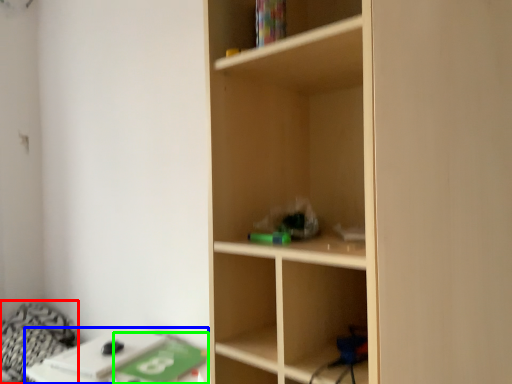
Question: Which object is positioned closest to bedding (highlighted by a red box)? Select from table (highlighted by a blue box) and paperback book (highlighted by a green box).

Choices:
 (A) table
 (B) paperback book

Answer: (A)